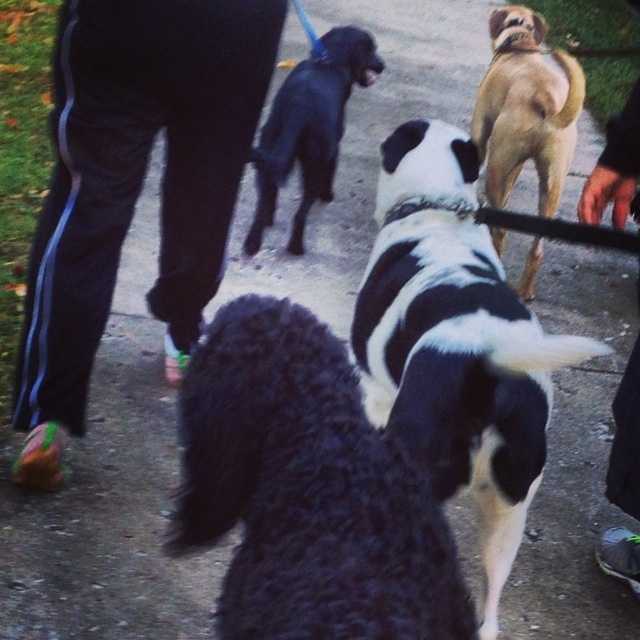
Based on the scene description and the provided coordinates, which object corresponds to the point labeled at coordinates (456, 342)?

The point labeled at coordinates (456, 342) corresponds to the black and white fur at center.

You are standing at the park and see the black and white fur at center and the tan smooth coat dog at upper right. Which dog is closer to you?

The black and white fur at center is closer to you because it is located below the tan smooth coat dog at upper right, meaning it is in front of the other dog.

You are a photographer trying to capture a group photo of the fluffy black dog at center and the tan smooth coat dog at upper right. If you want to ensure both dogs fit in the frame without cropping either, which dog should you position closer to the center of the camera to account for their sizes?

The fluffy black dog at center is wider than the tan smooth coat dog at upper right, so positioning the fluffy black dog at center closer to the center of the camera would ensure both fit without cropping.